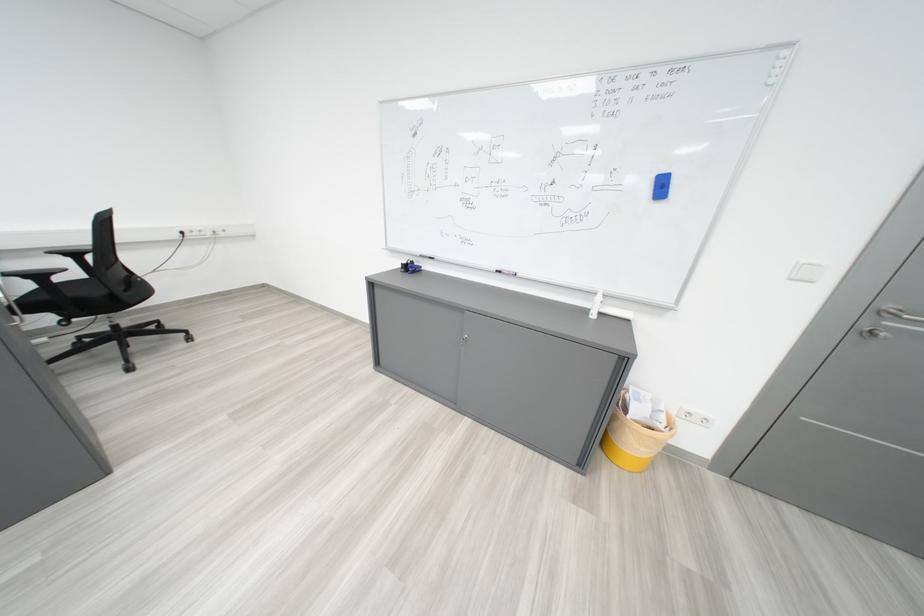
This screenshot has width=924, height=616. What do you see at coordinates (694, 416) in the screenshot?
I see `the white light switch` at bounding box center [694, 416].